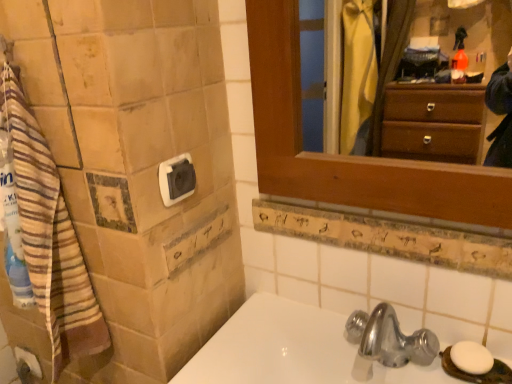
I want to click on white matte soap at lower right, so click(x=471, y=357).

What is the approximate height of white matte soap at lower right?

0.76 inches.

In the scene shown: What is the approximate width of brown striped towel at left?

5.85 inches.

The image size is (512, 384). Describe the element at coordinates (27, 366) in the screenshot. I see `white matte toilet paper at lower left` at that location.

Based on the photo, in order to face white matte toilet paper at lower left, should I rotate leftwards or rightwards?

You should look left and rotate roughly 27.749 degrees.

Image resolution: width=512 pixels, height=384 pixels. What do you see at coordinates (389, 235) in the screenshot?
I see `wooden ledge at upper center` at bounding box center [389, 235].

Find the location of a particular element. white matte soap at lower right is located at coordinates (471, 357).

Is wooden frame at upper right with white matte toilet paper at lower left?

wooden frame at upper right and white matte toilet paper at lower left are not in contact.

Is wooden frame at upper right situated inside white matte toilet paper at lower left or outside?

The correct answer is: outside.

Is wooden frame at upper right looking in the opposite direction of white matte toilet paper at lower left?

No, wooden frame at upper right is not facing away from white matte toilet paper at lower left.

Is point (395, 77) behind point (29, 370)?

Yes, point (395, 77) is farther from viewer.

Considering the sizes of white matte toilet paper at lower left and brown striped towel at left in the image, is white matte toilet paper at lower left wider or thinner than brown striped towel at left?

Considering their sizes, white matte toilet paper at lower left looks slimmer than brown striped towel at left.

Considering the relative positions of white matte toilet paper at lower left and brown striped towel at left in the image provided, is white matte toilet paper at lower left to the left or to the right of brown striped towel at left?

In the image, white matte toilet paper at lower left appears on the left side of brown striped towel at left.

Consider the image. Are white matte toilet paper at lower left and brown striped towel at left located far from each other?

No.

Between white matte toilet paper at lower left and brown striped towel at left, which one has smaller size?

white matte toilet paper at lower left is smaller.

Does point (19, 369) appear closer or farther from the camera than point (226, 369)?

Point (19, 369) is positioned farther from the camera compared to point (226, 369).

From a real-world perspective, is white matte toilet paper at lower left over white glossy sink at lower center?

No, from a real-world perspective, white matte toilet paper at lower left is not above white glossy sink at lower center.

Can you confirm if white matte toilet paper at lower left is shorter than white glossy sink at lower center?

Yes.

Is white matte toilet paper at lower left positioned with its back to white glossy sink at lower center?

No, white matte toilet paper at lower left is not facing away from white glossy sink at lower center.

How much distance is there between white matte toilet paper at lower left and wooden frame at upper right?

white matte toilet paper at lower left is 6.98 feet from wooden frame at upper right.

In the scene shown: Would you say white matte toilet paper at lower left is inside or outside wooden frame at upper right?

white matte toilet paper at lower left is spatially situated outside wooden frame at upper right.

Does white matte toilet paper at lower left have a smaller size compared to wooden frame at upper right?

Yes.

Is white matte toilet paper at lower left oriented towards wooden frame at upper right?

No, white matte toilet paper at lower left is not aimed at wooden frame at upper right.

Is white matte toilet paper at lower left taller than white matte soap at lower right?

Indeed, white matte toilet paper at lower left has a greater height compared to white matte soap at lower right.

Is white matte toilet paper at lower left wider or thinner than white matte soap at lower right?

In the image, white matte toilet paper at lower left appears to be more narrow than white matte soap at lower right.

What's the angular difference between white matte toilet paper at lower left and white matte soap at lower right's facing directions?

1.33 degrees separate the facing orientations of white matte toilet paper at lower left and white matte soap at lower right.

Is white matte soap at lower right smaller than wooden frame at upper right?

Correct, white matte soap at lower right occupies less space than wooden frame at upper right.

Who is shorter, white matte soap at lower right or wooden frame at upper right?

Standing shorter between the two is white matte soap at lower right.

How many degrees apart are the facing directions of white matte soap at lower right and wooden frame at upper right?

They differ by 1.33 degrees in their facing directions.

From the image's perspective, relative to wooden frame at upper right, is white matte soap at lower right above or below?

white matte soap at lower right is below wooden frame at upper right.

From the image's perspective, is white matte toilet paper at lower left under wooden ledge at upper center?

Yes.

The height and width of the screenshot is (384, 512). I want to click on toilet paper located behind the wooden ledge at upper center, so click(x=27, y=366).

Can you confirm if white matte toilet paper at lower left is smaller than wooden ledge at upper center?

Yes.

Identify the location of mirror in front of the white matte toilet paper at lower left. Image resolution: width=512 pixels, height=384 pixels. (435, 99).

This screenshot has width=512, height=384. In order to click on bath towel that is above the white matte toilet paper at lower left (from a real-world perspective) in this screenshot , I will do `click(50, 237)`.

Estimate the real-world distances between objects in this image. Which object is further from wooden ledge at upper center, white matte soap at lower right or wooden frame at upper right?

The object further to wooden ledge at upper center is wooden frame at upper right.

Based on their spatial positions, is white plastic towel bar at upper left or white matte soap at lower right closer to wooden frame at upper right?

white matte soap at lower right is closer to wooden frame at upper right.

From the image, which object appears to be nearer to white matte soap at lower right, brown striped towel at left or wooden ledge at upper center?

wooden ledge at upper center is closer to white matte soap at lower right.

When comparing their distances from wooden ledge at upper center, does brown striped towel at left or white glossy sink at lower center seem closer?

white glossy sink at lower center is positioned closer to the anchor wooden ledge at upper center.

Considering their positions, is white plastic towel bar at upper left positioned further to white matte toilet paper at lower left than white glossy sink at lower center?

Based on the image, white plastic towel bar at upper left appears to be further to white matte toilet paper at lower left.

Estimate the real-world distances between objects in this image. Which object is further from white plastic towel bar at upper left, white glossy sink at lower center or white matte toilet paper at lower left?

white matte toilet paper at lower left is positioned further to the anchor white plastic towel bar at upper left.

Considering their positions, is wooden frame at upper right positioned closer to white plastic towel bar at upper left than white glossy sink at lower center?

white glossy sink at lower center is closer to white plastic towel bar at upper left.

From the image, which object appears to be farther from white matte soap at lower right, white matte toilet paper at lower left or white glossy sink at lower center?

Among the two, white matte toilet paper at lower left is located further to white matte soap at lower right.

This screenshot has width=512, height=384. I want to click on sink between white matte toilet paper at lower left and white matte soap at lower right, so click(275, 346).

The image size is (512, 384). Identify the location of towel bar located between white matte toilet paper at lower left and white matte soap at lower right in the left-right direction. (176, 179).

Where is `mirror located between white matte toilet paper at lower left and white matte soap at lower right in the left-right direction`? mirror located between white matte toilet paper at lower left and white matte soap at lower right in the left-right direction is located at coordinates (435, 99).

Find the location of a particular element. This screenshot has width=512, height=384. bath towel between white matte toilet paper at lower left and white matte soap at lower right in the horizontal direction is located at coordinates (50, 237).